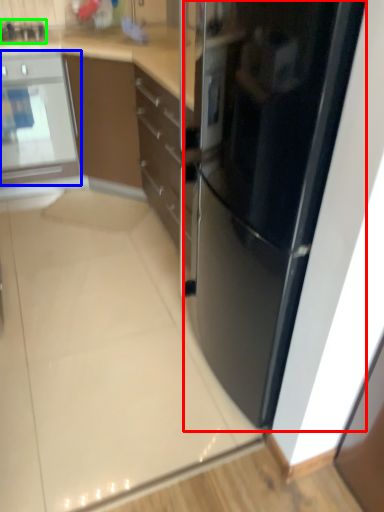
Question: Which is nearer to the refrigerator (highlighted by a red box)? home appliance (highlighted by a blue box) or appliance (highlighted by a green box).

Choices:
 (A) home appliance
 (B) appliance

Answer: (A)